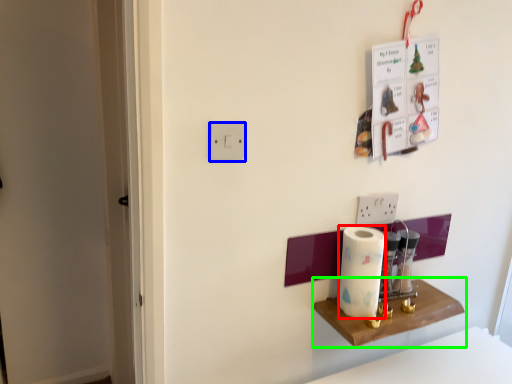
Question: Which object is the farthest from paper towel (highlighted by a red box)? Choose among these: light switch (highlighted by a blue box) or shelf (highlighted by a green box).

Choices:
 (A) light switch
 (B) shelf

Answer: (A)